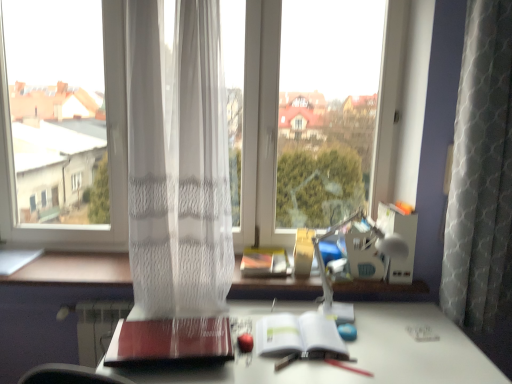
Question: Considering the relative sizes of transparent fabric at center and white paper at center, positioned as the second paperback book in left-to-right order, in the image provided, is transparent fabric at center taller than white paper at center, positioned as the second paperback book in left-to-right order,?

Choices:
 (A) no
 (B) yes

Answer: (B)

Question: Is transparent fabric at center beside white paper at center, positioned as the second paperback book in left-to-right order?

Choices:
 (A) yes
 (B) no

Answer: (B)

Question: Is transparent fabric at center located outside white paper at center, positioned as the second paperback book in left-to-right order?

Choices:
 (A) yes
 (B) no

Answer: (A)

Question: Does transparent fabric at center have a greater width compared to white paper at center, which is counted as the 1th paperback book, starting from the right?

Choices:
 (A) no
 (B) yes

Answer: (A)

Question: Is transparent fabric at center facing towards white paper at center, which is counted as the 1th paperback book, starting from the right?

Choices:
 (A) no
 (B) yes

Answer: (B)

Question: Can you confirm if transparent fabric at center is positioned to the right of white paper at center, positioned as the second paperback book in left-to-right order?

Choices:
 (A) no
 (B) yes

Answer: (A)

Question: From a real-world perspective, is white sheer curtain at center beneath transparent fabric at center?

Choices:
 (A) no
 (B) yes

Answer: (B)

Question: Is white sheer curtain at center thinner than transparent fabric at center?

Choices:
 (A) yes
 (B) no

Answer: (B)

Question: From a real-world perspective, does white sheer curtain at center stand above transparent fabric at center?

Choices:
 (A) yes
 (B) no

Answer: (B)

Question: Does white sheer curtain at center contain transparent fabric at center?

Choices:
 (A) yes
 (B) no

Answer: (B)

Question: From the image's perspective, is white sheer curtain at center located above transparent fabric at center?

Choices:
 (A) yes
 (B) no

Answer: (B)

Question: Could you tell me if white sheer curtain at center is turned towards transparent fabric at center?

Choices:
 (A) no
 (B) yes

Answer: (A)

Question: Is white glossy desk at center positioned in front of white sheer curtain at center?

Choices:
 (A) yes
 (B) no

Answer: (A)